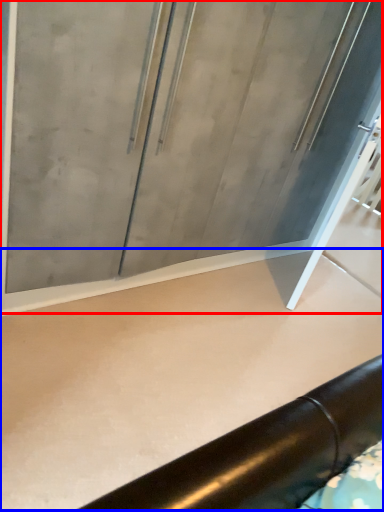
Question: Which object is closer to the camera taking this photo, glass door (highlighted by a red box) or concrete (highlighted by a blue box)?

Choices:
 (A) glass door
 (B) concrete

Answer: (B)